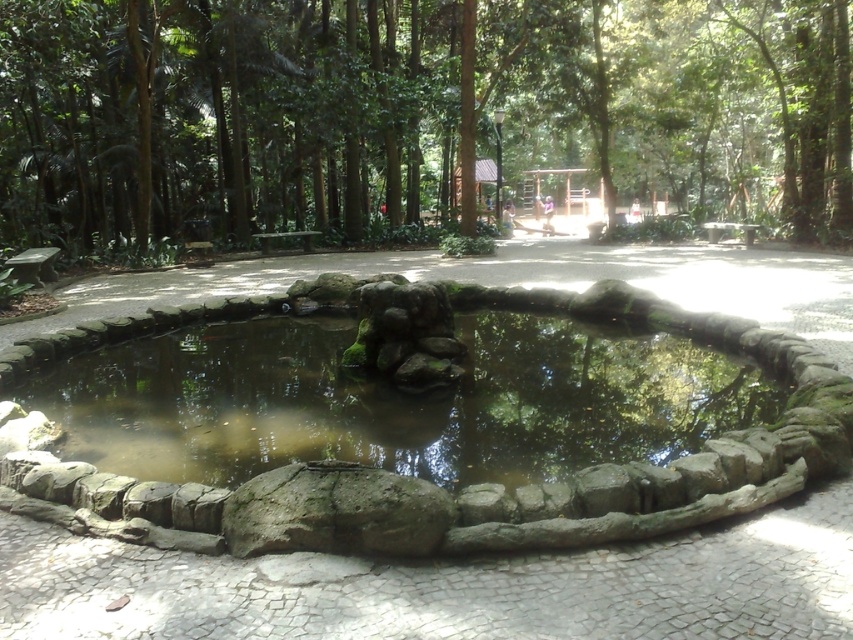
You are a bird looking for a place to land. You see the green leafy tree at center and the clear water at pond center. Which location would provide a higher spot to perch?

The green leafy tree at center is taller than the clear water at pond center, so the green leafy tree at center offers a higher spot to perch.

You are standing at the edge of the pond and want to walk directly to the green leafy tree at center. Which direction should you head?

Since the green leafy tree at center is located at point (x=408, y=108) in the image, you should head towards the center of the image to reach it.

You are standing on the paved pathway near the pond and want to see the reflection of the green leafy tree at center in the clear water at pond center. Can you see it reflected there?

The green leafy tree at center is above the clear water at pond center, so its reflection should be visible in the water.